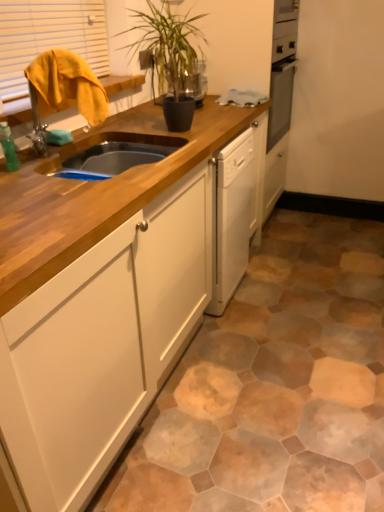
Question: From the image's perspective, is green leafy plant at upper center on top of green matte bottle at left?

Choices:
 (A) yes
 (B) no

Answer: (A)

Question: Is green matte bottle at left a part of green leafy plant at upper center?

Choices:
 (A) no
 (B) yes

Answer: (A)

Question: Would you say green leafy plant at upper center is a long distance from green matte bottle at left?

Choices:
 (A) no
 (B) yes

Answer: (A)

Question: Does green leafy plant at upper center have a larger size compared to green matte bottle at left?

Choices:
 (A) no
 (B) yes

Answer: (B)

Question: From a real-world perspective, is green leafy plant at upper center physically above green matte bottle at left?

Choices:
 (A) no
 (B) yes

Answer: (B)

Question: Considering the positions of wooden cabinet at center and green leafy plant at upper center in the image, is wooden cabinet at center bigger or smaller than green leafy plant at upper center?

Choices:
 (A) small
 (B) big

Answer: (B)

Question: Does point (147, 122) appear closer or farther from the camera than point (142, 40)?

Choices:
 (A) closer
 (B) farther

Answer: (A)

Question: From the image's perspective, relative to green leafy plant at upper center, is wooden cabinet at center above or below?

Choices:
 (A) below
 (B) above

Answer: (A)

Question: From a real-world perspective, is wooden cabinet at center positioned above or below green leafy plant at upper center?

Choices:
 (A) above
 (B) below

Answer: (B)

Question: Relative to yellow fabric at upper left, is wooden cabinet at center in front or behind?

Choices:
 (A) behind
 (B) front

Answer: (B)

Question: From the image's perspective, relative to yellow fabric at upper left, is wooden cabinet at center above or below?

Choices:
 (A) above
 (B) below

Answer: (B)

Question: Considering the positions of wooden cabinet at center and yellow fabric at upper left in the image, is wooden cabinet at center taller or shorter than yellow fabric at upper left?

Choices:
 (A) tall
 (B) short

Answer: (A)

Question: Is wooden cabinet at center bigger or smaller than yellow fabric at upper left?

Choices:
 (A) small
 (B) big

Answer: (B)

Question: Do you think green leafy plant at upper center is within wooden cabinet at center, or outside of it?

Choices:
 (A) inside
 (B) outside

Answer: (B)

Question: Is point (190, 64) positioned closer to the camera than point (132, 309)?

Choices:
 (A) farther
 (B) closer

Answer: (A)